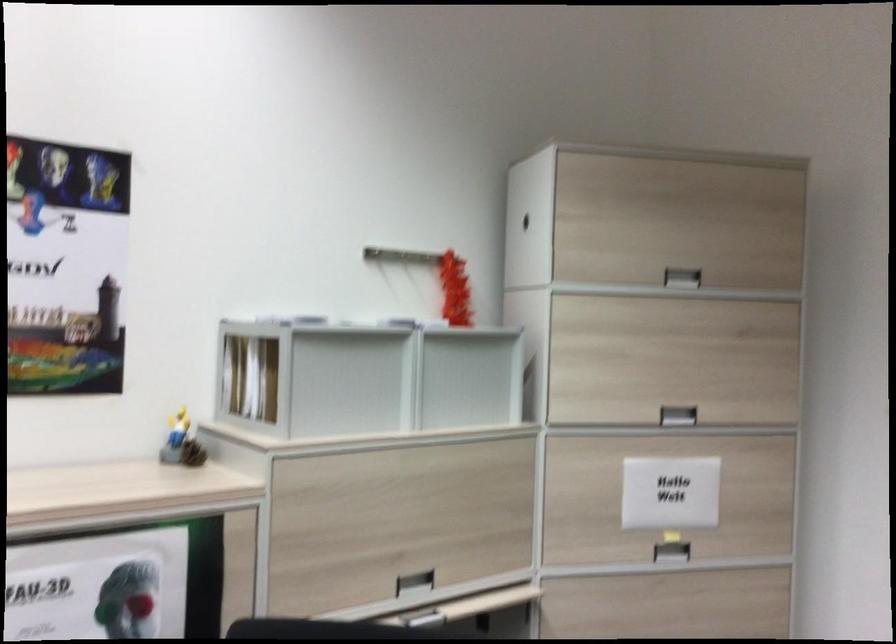
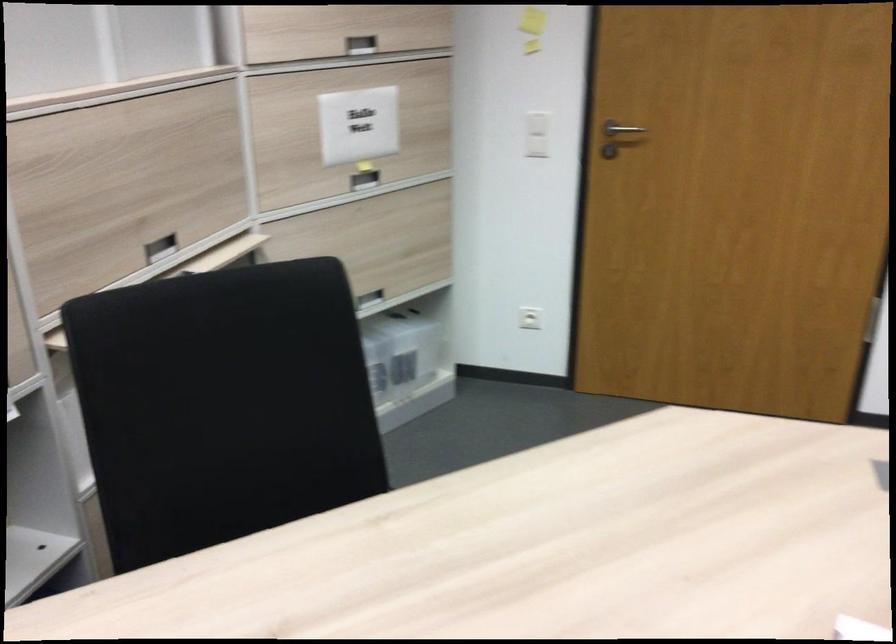
In the second image, find the point that corresponds to pixel 673 550 in the first image.

(364, 180)